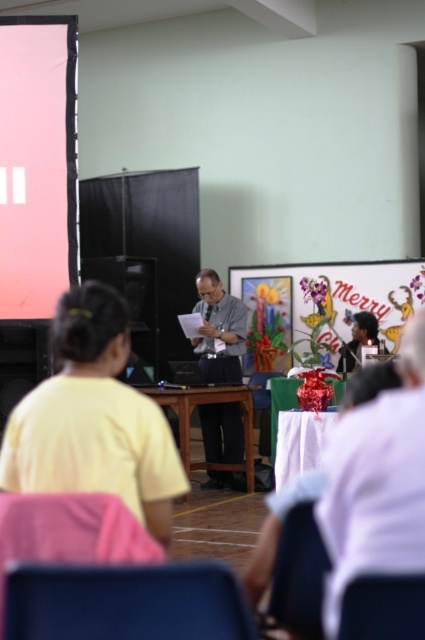
You are organizing a small workshop and need to seat two participants. You have a matte blue chair at lower center and a matte black hair at center. Which object is narrower?

The matte blue chair at lower center is narrower than the matte black hair at center.

You are organizing a small event and need to seat two guests. You have a pink fabric chair at lower left and a matte black hair at center. Which chair has a larger seating capacity?

The matte black hair at center has a larger seating capacity because its width is greater than the pink fabric chair at lower left.

You are sitting in the pink fabric chair at lower left and want to see the matte black hair at center better. Can you move forward to get a better view without leaving your seat?

The pink fabric chair at lower left is already closer to the viewer than the matte black hair at center, so moving forward from your seat won